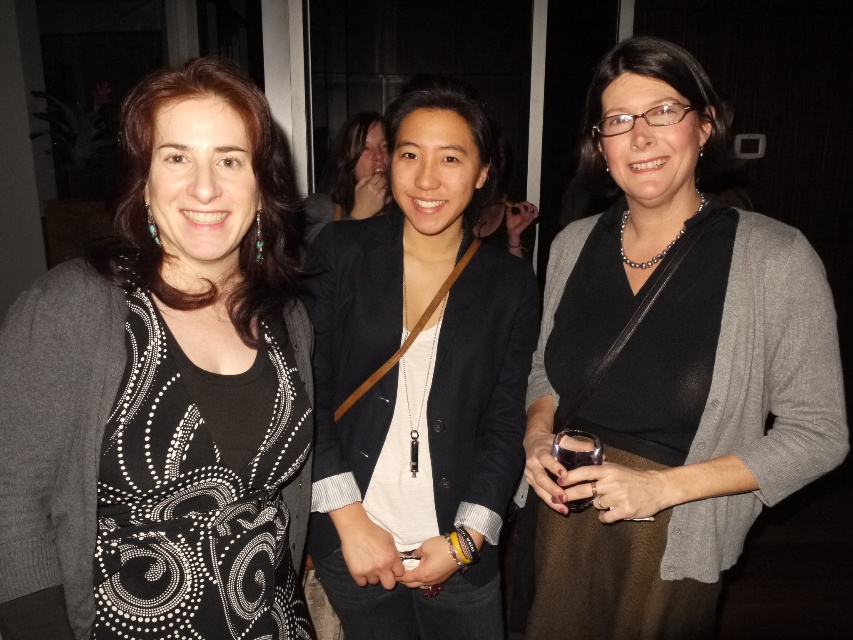
Is black matte dress at center below matte black blazer at center?

Yes.

Identify the location of black matte dress at center. (167, 390).

Consider the image. Is black matte sweater at center taller than matte black blazer at center?

Yes, black matte sweater at center is taller than matte black blazer at center.

Looking at this image, is the position of black matte sweater at center less distant than that of matte black blazer at center?

Yes, it is.

At what (x,y) coordinates should I click in order to perform the action: click on black matte sweater at center. Please return your answer as a coordinate pair (x, y). The image size is (853, 640). Looking at the image, I should click on (669, 369).

Is black matte blazer at center closer to the viewer compared to matte black blazer at center?

Yes, it is.

Between point (436, 566) and point (358, 204), which one is positioned in front?

Positioned in front is point (436, 566).

Is point (378, 252) closer to camera compared to point (331, 188)?

Yes, point (378, 252) is in front of point (331, 188).

The width and height of the screenshot is (853, 640). What are the coordinates of `black matte blazer at center` in the screenshot? It's located at (418, 385).